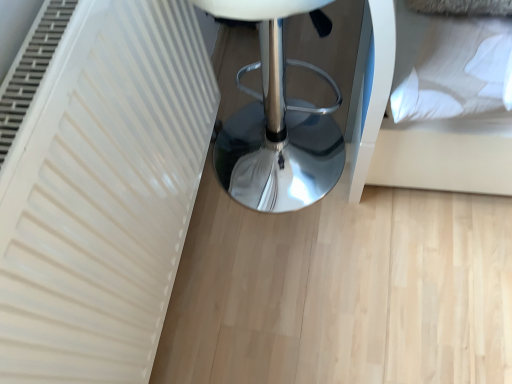
Describe the element at coordinates (276, 122) in the screenshot. The image size is (512, 384). I see `white glossy stool at center` at that location.

Where is `white glossy stool at center`? The height and width of the screenshot is (384, 512). white glossy stool at center is located at coordinates (276, 122).

This screenshot has width=512, height=384. Describe the element at coordinates (416, 132) in the screenshot. I see `white soft pillow at upper right` at that location.

Find the location of a particular element. The height and width of the screenshot is (384, 512). white soft pillow at upper right is located at coordinates (416, 132).

Measure the distance between white soft pillow at upper right and camera.

23.17 inches.

I want to click on white glossy stool at center, so [276, 122].

Considering the relative positions of white glossy stool at center and white soft pillow at upper right in the image provided, is white glossy stool at center to the left or to the right of white soft pillow at upper right?

white glossy stool at center is to the left of white soft pillow at upper right.

Is white glossy stool at center in front of or behind white soft pillow at upper right in the image?

In the image, white glossy stool at center appears in front of white soft pillow at upper right.

Considering the positions of point (263, 177) and point (360, 165), is point (263, 177) closer or farther from the camera than point (360, 165)?

Point (263, 177) is farther from the camera than point (360, 165).

Consider the image. From the image's perspective, is white glossy stool at center positioned above or below white soft pillow at upper right?

From the image's perspective, white glossy stool at center appears below white soft pillow at upper right.

From a real-world perspective, which object stands above the other?

white soft pillow at upper right is physically above.

Does white glossy stool at center have a greater width compared to white soft pillow at upper right?

Correct, the width of white glossy stool at center exceeds that of white soft pillow at upper right.

Which of these two, white glossy stool at center or white soft pillow at upper right, stands shorter?

With less height is white soft pillow at upper right.

Can you confirm if white glossy stool at center is bigger than white soft pillow at upper right?

Yes.

Is white glossy stool at center situated inside white soft pillow at upper right or outside?

white glossy stool at center lies outside white soft pillow at upper right.

Are white glossy stool at center and white soft pillow at upper right far apart?

white glossy stool at center is actually quite close to white soft pillow at upper right.

Is white glossy stool at center facing away from white soft pillow at upper right?

No, white soft pillow at upper right is not at the back of white glossy stool at center.

Can you tell me how much white glossy stool at center and white soft pillow at upper right differ in facing direction?

white glossy stool at center and white soft pillow at upper right are facing 87.2 degrees away from each other.

How far apart are white glossy stool at center and white soft pillow at upper right?

white glossy stool at center is 10.65 inches from white soft pillow at upper right.

The image size is (512, 384). I want to click on furniture in front of the white soft pillow at upper right, so click(276, 122).

Is white soft pillow at upper right to the right of white glossy stool at center from the viewer's perspective?

Yes, white soft pillow at upper right is to the right of white glossy stool at center.

Is the depth of white soft pillow at upper right greater than that of white glossy stool at center?

Yes, the depth of white soft pillow at upper right is greater than that of white glossy stool at center.

Between point (399, 172) and point (266, 68), which one is positioned behind?

The point (399, 172) is behind.

From the image's perspective, does white soft pillow at upper right appear lower than white glossy stool at center?

Incorrect, from the image's perspective, white soft pillow at upper right is higher than white glossy stool at center.

Looking at this image, from a real-world perspective, which object stands above the other?

In real-world perspective, white soft pillow at upper right is above.

Which object is wider, white soft pillow at upper right or white glossy stool at center?

With larger width is white glossy stool at center.

Considering the relative sizes of white soft pillow at upper right and white glossy stool at center in the image provided, is white soft pillow at upper right taller than white glossy stool at center?

In fact, white soft pillow at upper right may be shorter than white glossy stool at center.

Who is smaller, white soft pillow at upper right or white glossy stool at center?

With smaller size is white soft pillow at upper right.

Is white soft pillow at upper right outside of white glossy stool at center?

white soft pillow at upper right is positioned outside white glossy stool at center.

Would you say white soft pillow at upper right is a long distance from white glossy stool at center?

No, there isn't a large distance between white soft pillow at upper right and white glossy stool at center.

Could you tell me if white soft pillow at upper right is turned towards white glossy stool at center?

No, white soft pillow at upper right does not turn towards white glossy stool at center.

Can you tell me how much white soft pillow at upper right and white glossy stool at center differ in facing direction?

87.2 degrees.

Where is `furniture that appears below the white soft pillow at upper right (from a real-world perspective)`? The height and width of the screenshot is (384, 512). furniture that appears below the white soft pillow at upper right (from a real-world perspective) is located at coordinates (276, 122).

Locate an element on the screen. The width and height of the screenshot is (512, 384). bed above the white glossy stool at center (from a real-world perspective) is located at coordinates (416, 132).

You are a GUI agent. You are given a task and a screenshot of the screen. Output one action in this format:
    pyautogui.click(x=<x>, y=<y>)
    Task: Click on the furniture below the white soft pillow at upper right (from the image's perspective)
    The width and height of the screenshot is (512, 384).
    Given the screenshot: What is the action you would take?
    pyautogui.click(x=276, y=122)